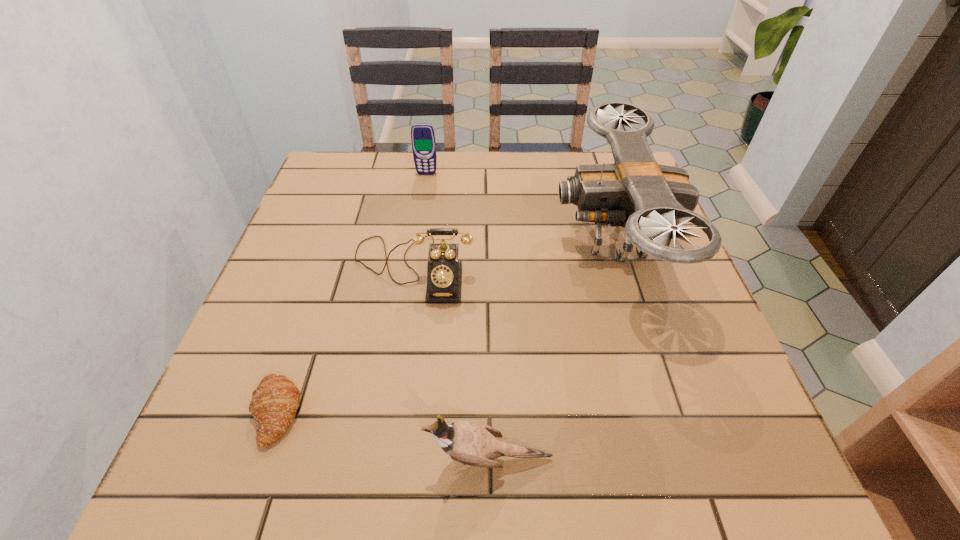
Identify the location of free space that is in between the bird and the cellular telephone. The width and height of the screenshot is (960, 540). (458, 316).

The image size is (960, 540). Identify the location of free space between the cellular telephone and the bird. 458,316.

At what (x,y) coordinates should I click in order to perform the action: click on vacant space that is in between the cellular telephone and the bird. Please return your answer as a coordinate pair (x, y). This screenshot has width=960, height=540. Looking at the image, I should click on (458, 316).

Locate an element on the screen. blank region between the telephone and the tallest object is located at coordinates (513, 253).

Image resolution: width=960 pixels, height=540 pixels. I want to click on vacant area between the rightmost object and the bird, so pos(551,348).

I want to click on vacant region between the crescent roll and the tallest object, so click(444, 325).

Locate an element on the screen. The image size is (960, 540). free point between the cellular telephone and the crescent roll is located at coordinates (351, 293).

You are a GUI agent. You are given a task and a screenshot of the screen. Output one action in this format:
    pyautogui.click(x=<x>, y=<y>)
    Task: Click on the empty location between the telephone and the bird
    This screenshot has height=540, width=960.
    Given the screenshot: What is the action you would take?
    pyautogui.click(x=451, y=363)

You are a GUI agent. You are given a task and a screenshot of the screen. Output one action in this format:
    pyautogui.click(x=<x>, y=<y>)
    Task: Click on the free space that is in between the telephone and the crescent roll
    The image size is (960, 540).
    Given the screenshot: What is the action you would take?
    pyautogui.click(x=345, y=340)

Image resolution: width=960 pixels, height=540 pixels. I want to click on object that is the second closest one to the bird, so click(273, 406).